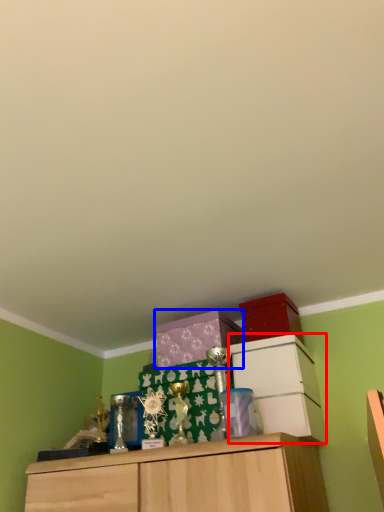
Question: Which object is further to the camera taking this photo, cabinetry (highlighted by a red box) or cabinetry (highlighted by a blue box)?

Choices:
 (A) cabinetry
 (B) cabinetry

Answer: (B)